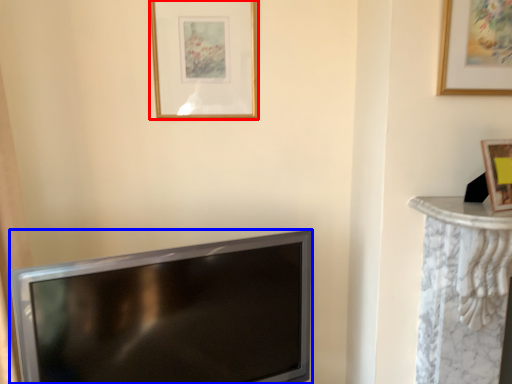
Question: Which object is further to the camera taking this photo, picture frame (highlighted by a red box) or television (highlighted by a blue box)?

Choices:
 (A) picture frame
 (B) television

Answer: (A)